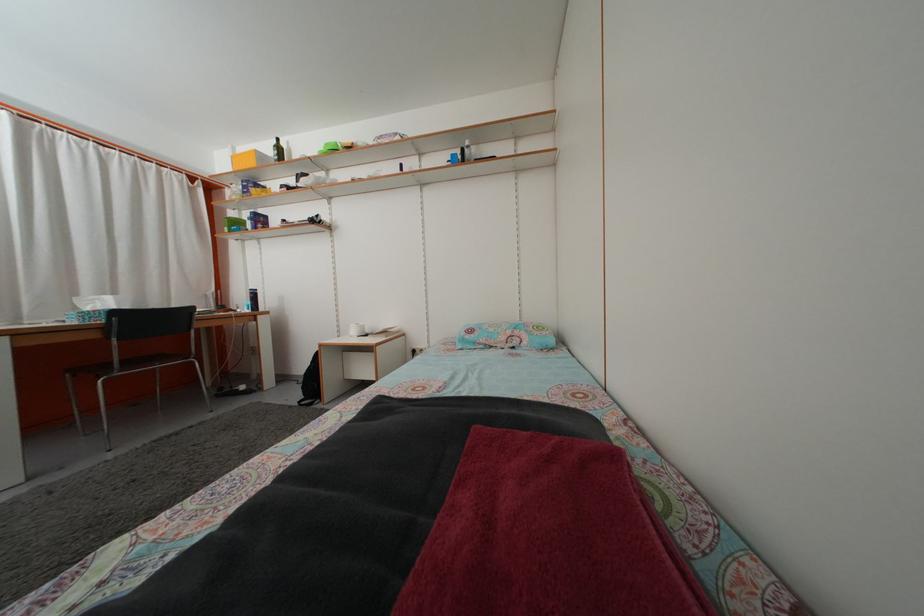
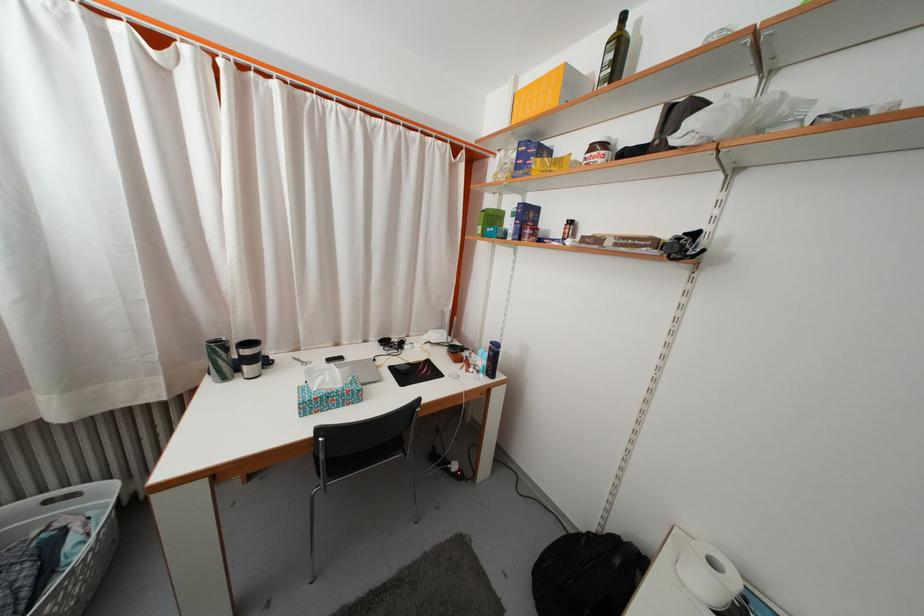
In the second image, find the point that corresponds to (x=286, y=156) in the first image.

(625, 54)